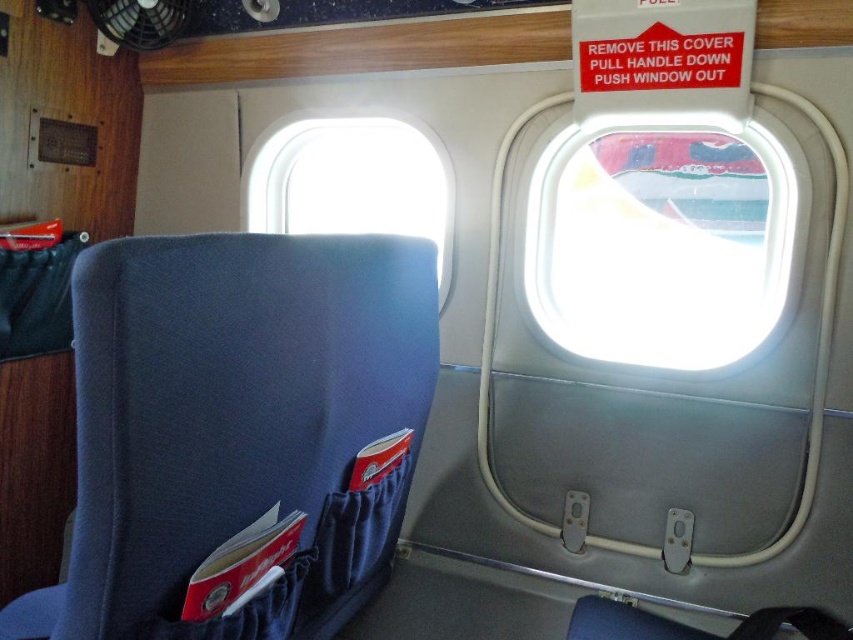
Between point (552, 259) and point (335, 138), which one is positioned behind?

The point (335, 138) is behind.

Between transparent plastic airplane window at upper right and blue fabric airplane window at upper center, which one is positioned lower?

transparent plastic airplane window at upper right is lower down.

Describe the element at coordinates (662, 241) in the screenshot. I see `transparent plastic airplane window at upper right` at that location.

At what (x,y) coordinates should I click in order to perform the action: click on transparent plastic airplane window at upper right. Please return your answer as a coordinate pair (x, y). The height and width of the screenshot is (640, 853). Looking at the image, I should click on (662, 241).